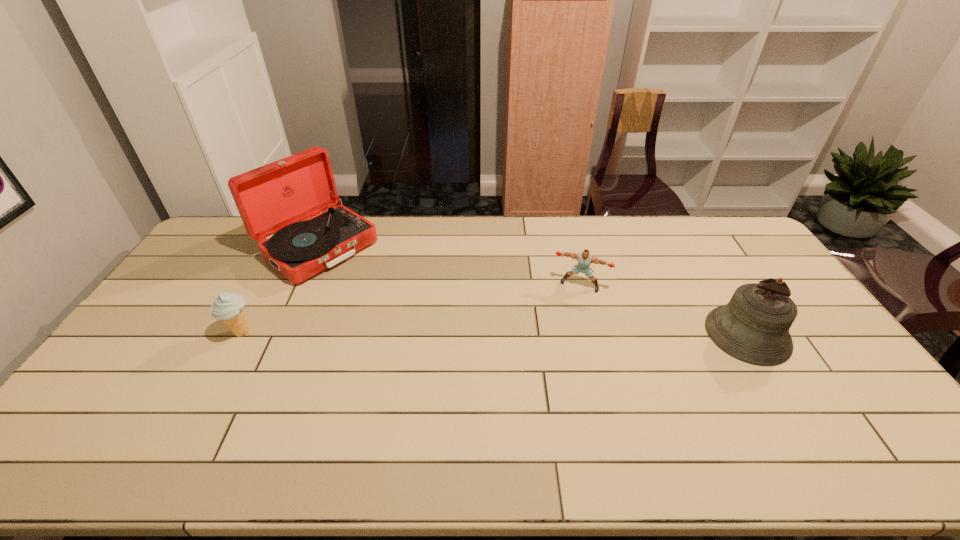
Identify which object is the nearest to the tallest object. Please provide its 2D coordinates. Your answer should be formatted as a tuple, i.e. [(x, y)], where the tuple contains the x and y coordinates of a point satisfying the conditions above.

[(229, 307)]

Find the location of `free space that satisfies the following two spatial constraints: 1. on the back side of the phonograph_record; 2. on the left side of the icecream`. free space that satisfies the following two spatial constraints: 1. on the back side of the phonograph_record; 2. on the left side of the icecream is located at coordinates (287, 248).